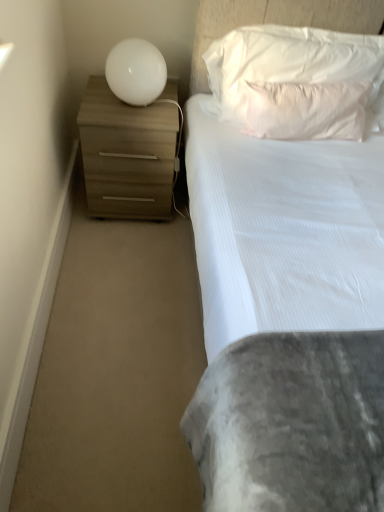
Where is `free location in front of matte wood chest of drawers at left`? This screenshot has width=384, height=512. free location in front of matte wood chest of drawers at left is located at coordinates (124, 250).